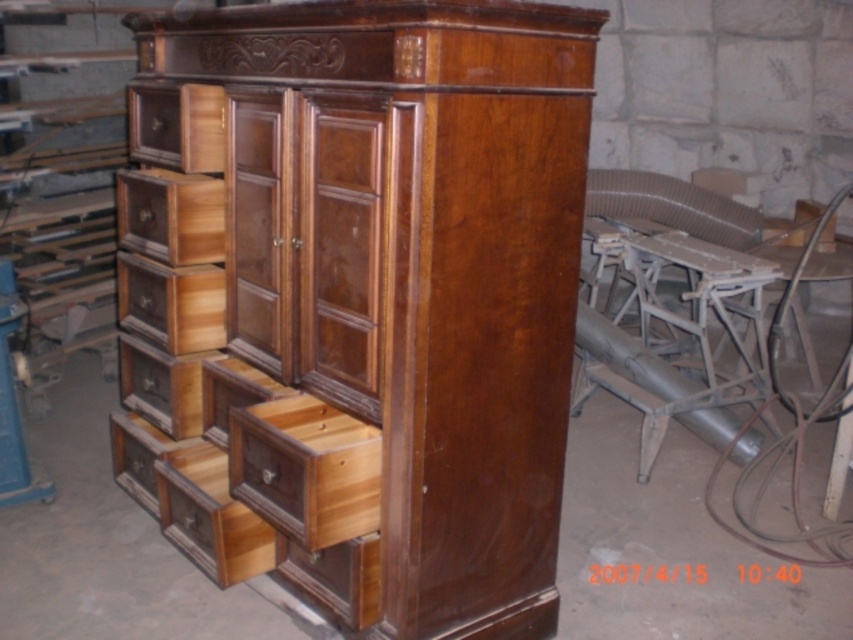
Which is more to the right, wooden drawer at center-left or wooden drawer at upper left?

wooden drawer at upper left is more to the right.

Can you confirm if wooden drawer at center-left is thinner than wooden drawer at upper left?

No.

Is point (160, 324) farther from camera compared to point (222, 168)?

Yes, point (160, 324) is behind point (222, 168).

The height and width of the screenshot is (640, 853). In order to click on wooden drawer at center-left in this screenshot , I will do `click(171, 304)`.

Who is positioned more to the right, shiny brown wood dresser at center or wooden drawer at upper left?

shiny brown wood dresser at center is more to the right.

Consider the image. Is shiny brown wood dresser at center closer to camera compared to wooden drawer at upper left?

Yes, shiny brown wood dresser at center is closer to the viewer.

Identify the location of shiny brown wood dresser at center. coord(405,282).

Does wooden drawer at left appear over wooden drawer at center-left?

Yes, wooden drawer at left is above wooden drawer at center-left.

Does wooden drawer at left lie in front of wooden drawer at center-left?

That is True.

Who is more distant from viewer, (x=193, y=225) or (x=169, y=333)?

The point (x=169, y=333) is more distant.

The height and width of the screenshot is (640, 853). In order to click on wooden drawer at left in this screenshot , I will do `click(170, 216)`.